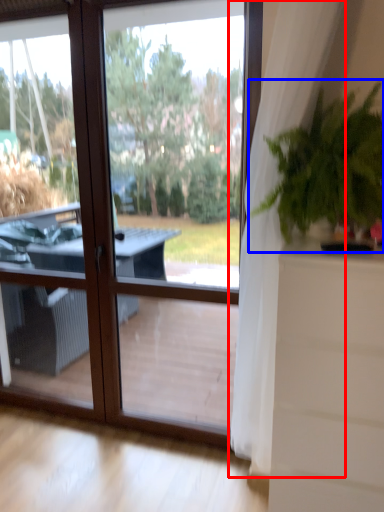
Question: Among these objects, which one is nearest to the camera, curtain (highlighted by a red box) or houseplant (highlighted by a blue box)?

Choices:
 (A) curtain
 (B) houseplant

Answer: (A)